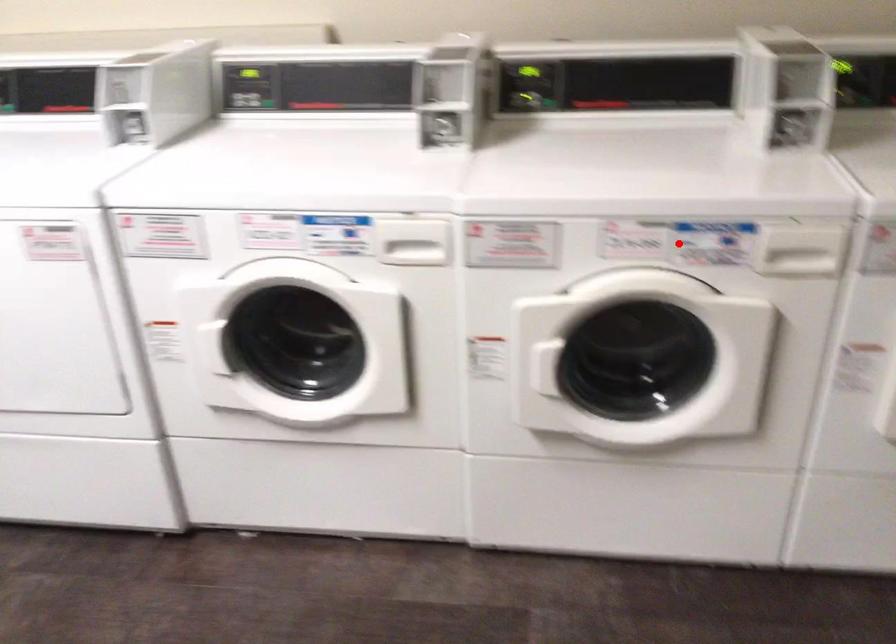
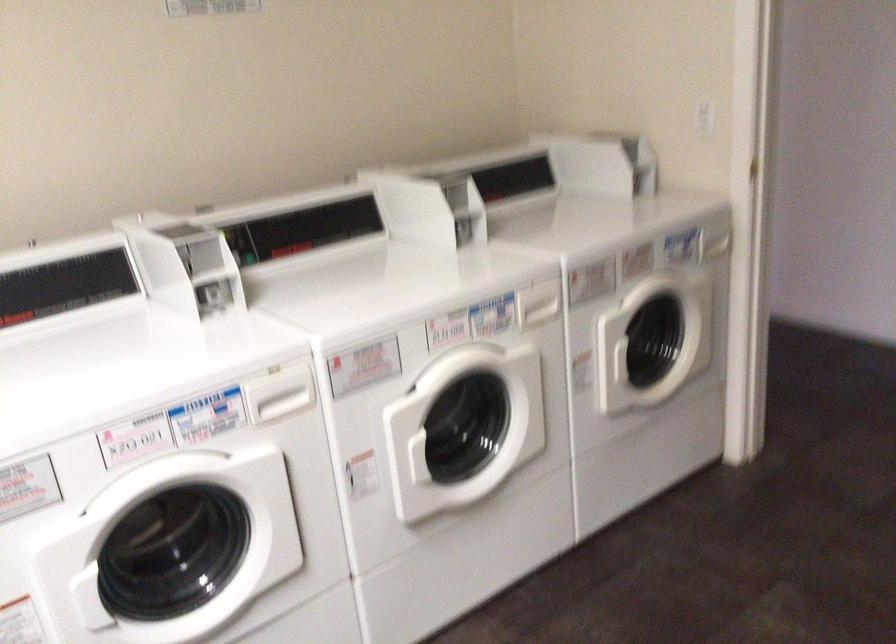
Locate, in the second image, the point that corresponds to the highlighted location in the first image.

(474, 322)